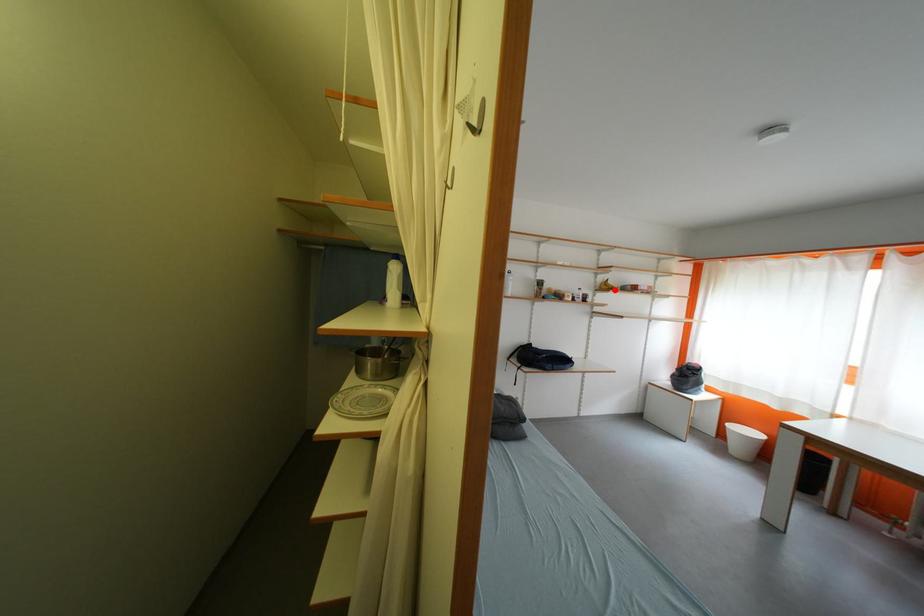
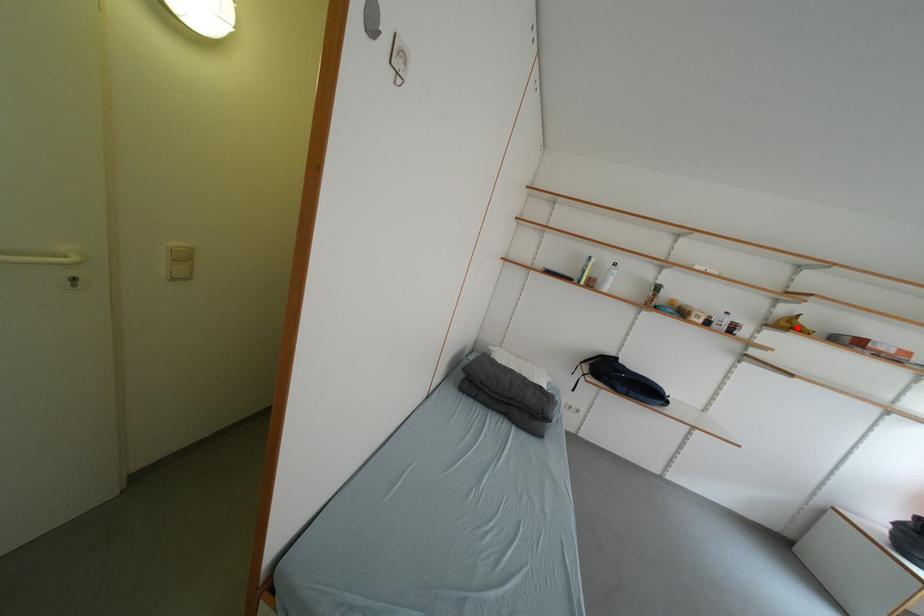
I am providing you with two images of the same scene from different viewpoints. A red point is marked on the first image and another point is marked on the second image. Are the points marked in image1 and image2 representing the same 3D position?

Yes